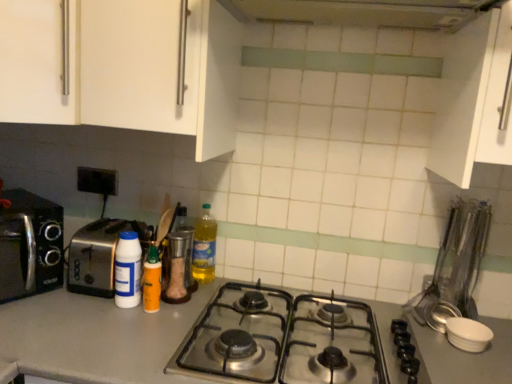
Question: Is translucent plastic bottle at center, acting as the 4th bottle starting from the left, located outside silver metallic toaster at left, the 2th toaster positioned from the right?

Choices:
 (A) no
 (B) yes

Answer: (B)

Question: Is translucent plastic bottle at center, acting as the 4th bottle starting from the left, positioned far away from silver metallic toaster at left, the 2th toaster positioned from the right?

Choices:
 (A) yes
 (B) no

Answer: (B)

Question: Is translucent plastic bottle at center, which ranks as the first bottle in right-to-left order, in contact with silver metallic toaster at left, the 2th toaster positioned from the right?

Choices:
 (A) no
 (B) yes

Answer: (A)

Question: Is translucent plastic bottle at center, acting as the 4th bottle starting from the left, positioned behind silver metallic toaster at left, the 2th toaster positioned from the right?

Choices:
 (A) yes
 (B) no

Answer: (A)

Question: From a real-world perspective, does translucent plastic bottle at center, which ranks as the first bottle in right-to-left order, sit lower than silver metallic toaster at left, the 2th toaster positioned from the right?

Choices:
 (A) yes
 (B) no

Answer: (A)

Question: Considering the relative sizes of translucent plastic bottle at center, which ranks as the first bottle in right-to-left order, and silver metallic toaster at left, the 2th toaster positioned from the right, in the image provided, is translucent plastic bottle at center, which ranks as the first bottle in right-to-left order, wider than silver metallic toaster at left, the 2th toaster positioned from the right,?

Choices:
 (A) yes
 (B) no

Answer: (B)

Question: From the image's perspective, is metallic silver exhaust hood at upper center beneath stainless steel utensils at right?

Choices:
 (A) yes
 (B) no

Answer: (B)

Question: Is metallic silver exhaust hood at upper center looking in the opposite direction of stainless steel utensils at right?

Choices:
 (A) yes
 (B) no

Answer: (B)

Question: From a real-world perspective, does metallic silver exhaust hood at upper center stand above stainless steel utensils at right?

Choices:
 (A) yes
 (B) no

Answer: (A)

Question: Does metallic silver exhaust hood at upper center touch stainless steel utensils at right?

Choices:
 (A) no
 (B) yes

Answer: (A)

Question: Could you tell me if metallic silver exhaust hood at upper center is turned towards stainless steel utensils at right?

Choices:
 (A) no
 (B) yes

Answer: (A)

Question: Is metallic silver exhaust hood at upper center far from stainless steel utensils at right?

Choices:
 (A) yes
 (B) no

Answer: (B)

Question: Considering the relative positions of orange matte squeeze bottle at center, placed as the third bottle when sorted from right to left, and translucent plastic bottle at center, acting as the 4th bottle starting from the left, in the image provided, is orange matte squeeze bottle at center, placed as the third bottle when sorted from right to left, in front of translucent plastic bottle at center, acting as the 4th bottle starting from the left,?

Choices:
 (A) yes
 (B) no

Answer: (A)